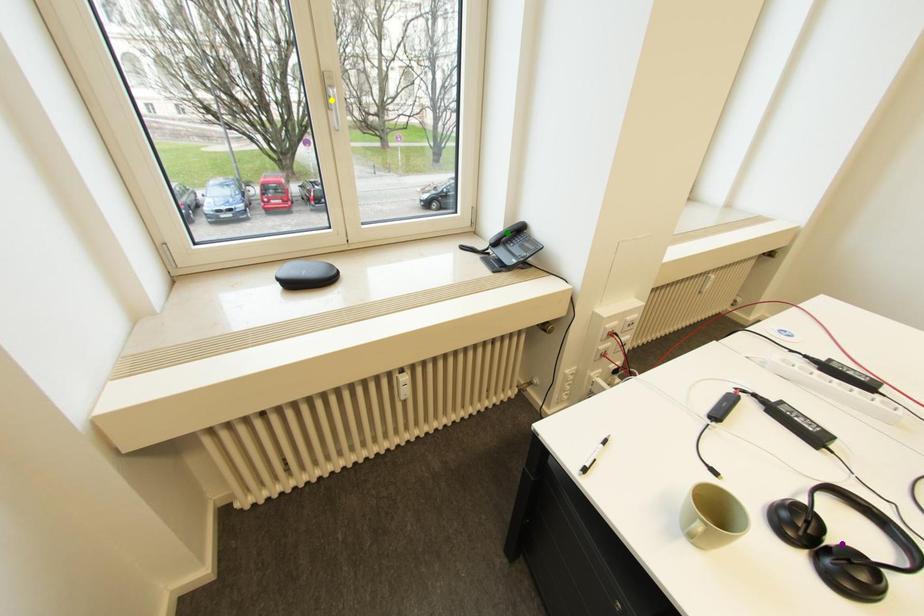
Order these from nearest to farthest:
1. purple point
2. yellow point
3. green point

purple point
yellow point
green point